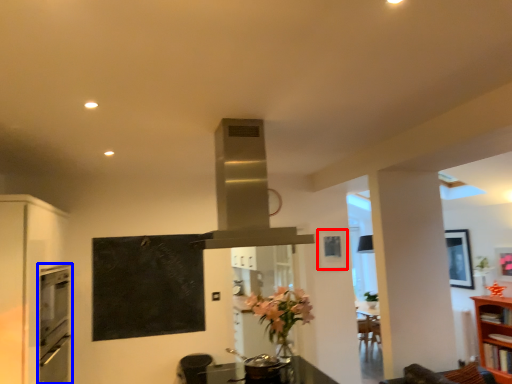
Question: Which of the following is the farthest to the observer, picture frame (highlighted by a red box) or oven (highlighted by a blue box)?

Choices:
 (A) picture frame
 (B) oven

Answer: (A)